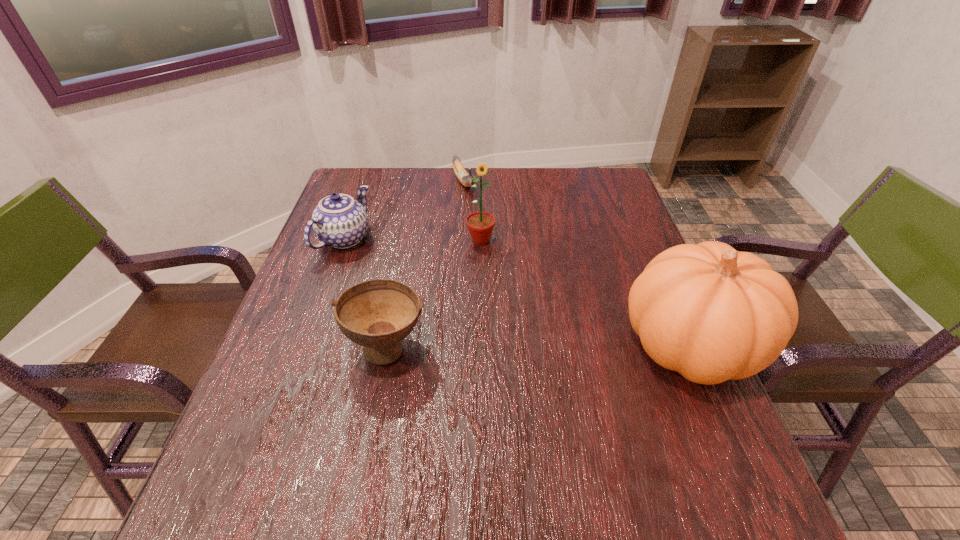
The width and height of the screenshot is (960, 540). What are the coordinates of `vacant space on the desktop that is between the soup bowl and the rightmost object and is positioned on the face of the sunflower` in the screenshot? It's located at (521, 346).

What are the coordinates of `free spot on the desktop that is between the fourth object from right to left and the rightmost object and is positioned at the spout of the chinaware` in the screenshot? It's located at (579, 346).

You are a GUI agent. You are given a task and a screenshot of the screen. Output one action in this format:
    pyautogui.click(x=<x>, y=<y>)
    Task: Click on the vacant space on the desktop that is between the soup bowl and the pumpkin and is positioned on the peel of the shortest object
    The height and width of the screenshot is (540, 960).
    Given the screenshot: What is the action you would take?
    click(x=569, y=346)